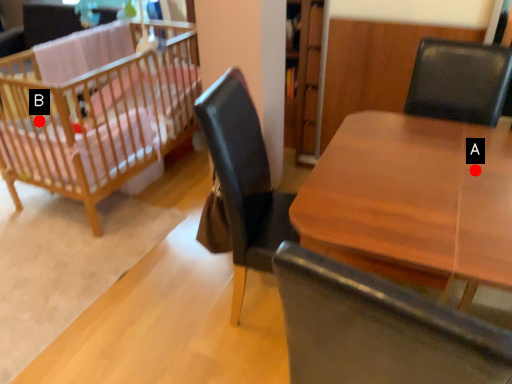
Question: Two points are circled on the image, labeled by A and B beside each circle. Which of the following is the farthest from the observer?

Choices:
 (A) A is further
 (B) B is further

Answer: (B)